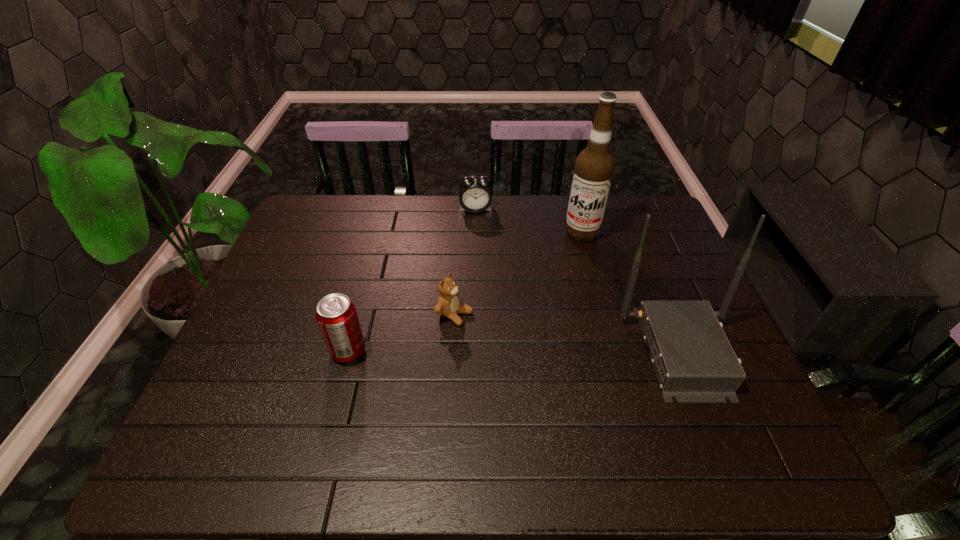
You are a GUI agent. You are given a task and a screenshot of the screen. Output one action in this format:
    pyautogui.click(x=<x>, y=<y>)
    Task: Click on the free space that satisfies the following two spatial constraints: 1. on the front side of the fourth shortest object; 2. on the back of the tallest object to connect cables
    The height and width of the screenshot is (540, 960).
    Given the screenshot: What is the action you would take?
    pyautogui.click(x=613, y=352)

Image resolution: width=960 pixels, height=540 pixels. I want to click on blank space that satisfies the following two spatial constraints: 1. on the back side of the teddy bear; 2. on the right side of the alarm clock, so (x=461, y=209).

Locate an element on the screen. The width and height of the screenshot is (960, 540). free space in the image that satisfies the following two spatial constraints: 1. on the front side of the farthest object; 2. on the back of the router to connect cables is located at coordinates (473, 352).

Find the location of `blank space that satisfies the following two spatial constraints: 1. on the front side of the router; 2. on the back of the fourth nearest object to connect cables`. blank space that satisfies the following two spatial constraints: 1. on the front side of the router; 2. on the back of the fourth nearest object to connect cables is located at coordinates (613, 352).